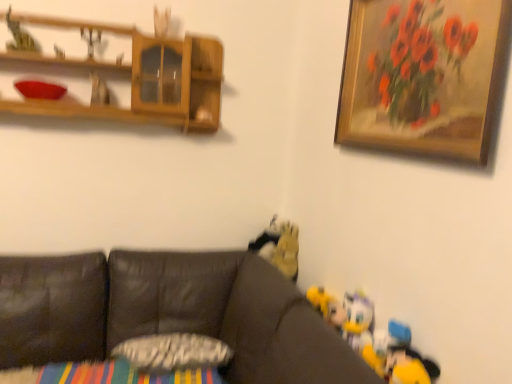
Question: Could metallic silver toy at upper left, the second toy from the back, be considered to be inside plush yellow duck at lower right, the 5th toy positioned from the back?

Choices:
 (A) yes
 (B) no

Answer: (B)

Question: Is there a large distance between plush yellow duck at lower right, which is the fifth toy from top to bottom, and metallic silver toy at upper left, the 3th toy in the top-to-bottom sequence?

Choices:
 (A) yes
 (B) no

Answer: (A)

Question: Does plush yellow duck at lower right, which is the 5th toy in left-to-right order, turn towards metallic silver toy at upper left, the fifth toy when ordered from front to back?

Choices:
 (A) yes
 (B) no

Answer: (B)

Question: From the image's perspective, is plush yellow duck at lower right, the second toy when ordered from bottom to top, beneath metallic silver toy at upper left, the fifth toy when ordered from front to back?

Choices:
 (A) yes
 (B) no

Answer: (A)

Question: Is plush yellow duck at lower right, the 5th toy positioned from the back, oriented away from metallic silver toy at upper left, marked as the 4th toy in a bottom-to-top arrangement?

Choices:
 (A) no
 (B) yes

Answer: (A)

Question: Considering the relative sizes of plush yellow duck at lower right, the 5th toy positioned from the back, and metallic silver toy at upper left, the 4th toy when ordered from right to left, in the image provided, is plush yellow duck at lower right, the 5th toy positioned from the back, taller than metallic silver toy at upper left, the 4th toy when ordered from right to left,?

Choices:
 (A) no
 (B) yes

Answer: (B)

Question: From a real-world perspective, is fluffy yellow toy at center, the third toy from the bottom, located beneath green felt toy at upper left, the fourth toy from the back?

Choices:
 (A) no
 (B) yes

Answer: (B)

Question: Can you confirm if fluffy yellow toy at center, the third toy from the bottom, is positioned to the left of green felt toy at upper left, which appears as the sixth toy when viewed from the right?

Choices:
 (A) no
 (B) yes

Answer: (A)

Question: Is fluffy yellow toy at center, which is counted as the 6th toy, starting from the front, looking in the opposite direction of green felt toy at upper left, which appears as the 6th toy when ordered from the bottom?

Choices:
 (A) no
 (B) yes

Answer: (A)

Question: From the image's perspective, is fluffy yellow toy at center, which is counted as the 6th toy, starting from the front, below green felt toy at upper left, arranged as the 1th toy when viewed from the top?

Choices:
 (A) no
 (B) yes

Answer: (B)

Question: Considering the relative sizes of fluffy yellow toy at center, which appears as the 4th toy when viewed from the top, and green felt toy at upper left, the fourth toy from the back, in the image provided, is fluffy yellow toy at center, which appears as the 4th toy when viewed from the top, wider than green felt toy at upper left, the fourth toy from the back,?

Choices:
 (A) no
 (B) yes

Answer: (B)

Question: Can green felt toy at upper left, acting as the first toy starting from the left, be found inside fluffy yellow toy at center, which appears as the 4th toy when viewed from the top?

Choices:
 (A) no
 (B) yes

Answer: (A)

Question: Can you confirm if wooden framed painting at upper right is wider than yellow plush toy at lower right, arranged as the 1th toy when viewed from the right?

Choices:
 (A) yes
 (B) no

Answer: (B)